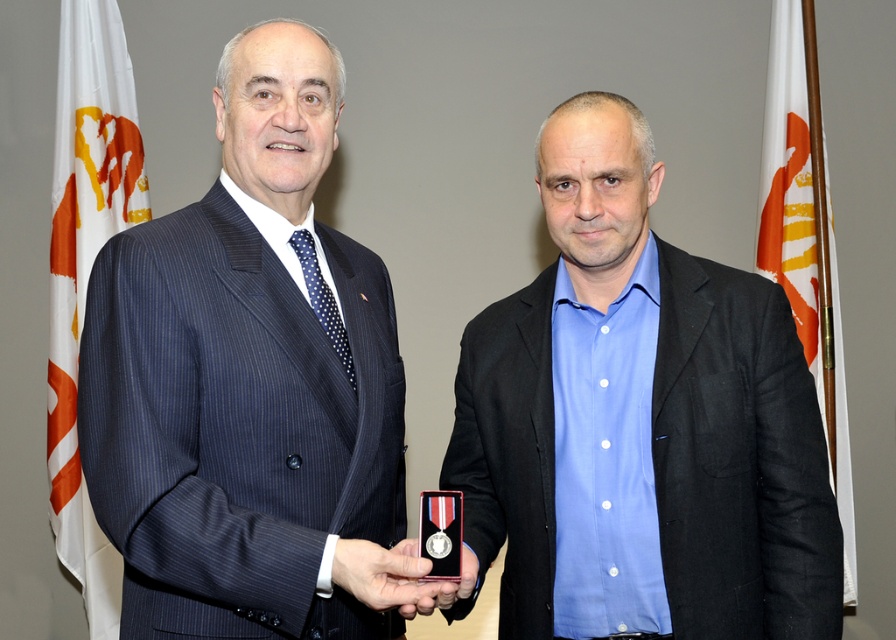
You are a photographer who needs to adjust the lighting to highlight the dark blue pinstripe suit at center. Since the current lighting is even and bright, where should you place the additional light relative to the point at (251, 385) to ensure the suit is properly illuminated?

Place the additional light directly at the point at (251, 385) where the dark blue pinstripe suit at center is located to ensure proper illumination.